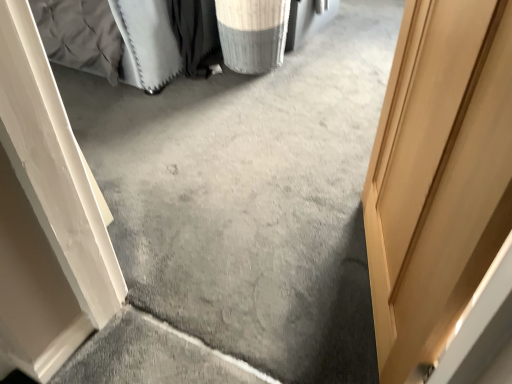
Question: Is white textured laundry basket at upper center located outside light brown wooden door at right?

Choices:
 (A) no
 (B) yes

Answer: (B)

Question: From the image's perspective, is white textured laundry basket at upper center above light brown wooden door at right?

Choices:
 (A) no
 (B) yes

Answer: (B)

Question: Is white textured laundry basket at upper center turned away from light brown wooden door at right?

Choices:
 (A) yes
 (B) no

Answer: (B)

Question: Can you confirm if white textured laundry basket at upper center is shorter than light brown wooden door at right?

Choices:
 (A) yes
 (B) no

Answer: (A)

Question: Considering the relative sizes of white textured laundry basket at upper center and light brown wooden door at right in the image provided, is white textured laundry basket at upper center taller than light brown wooden door at right?

Choices:
 (A) no
 (B) yes

Answer: (A)

Question: Is light brown wooden door at right a part of white textured laundry basket at upper center?

Choices:
 (A) yes
 (B) no

Answer: (B)

Question: From a real-world perspective, is light brown wooden door at right located beneath white textured laundry basket at upper center?

Choices:
 (A) no
 (B) yes

Answer: (A)

Question: Can you confirm if light brown wooden door at right is smaller than white textured laundry basket at upper center?

Choices:
 (A) no
 (B) yes

Answer: (A)

Question: Is there a large distance between light brown wooden door at right and white textured laundry basket at upper center?

Choices:
 (A) yes
 (B) no

Answer: (A)

Question: From the image's perspective, would you say light brown wooden door at right is shown under white textured laundry basket at upper center?

Choices:
 (A) yes
 (B) no

Answer: (A)

Question: Is light brown wooden door at right oriented away from white textured laundry basket at upper center?

Choices:
 (A) yes
 (B) no

Answer: (B)

Question: Could white textured laundry basket at upper center be considered to be inside light brown wooden door at right?

Choices:
 (A) no
 (B) yes

Answer: (A)

Question: Is white textured laundry basket at upper center bigger or smaller than light brown wooden door at right?

Choices:
 (A) small
 (B) big

Answer: (A)